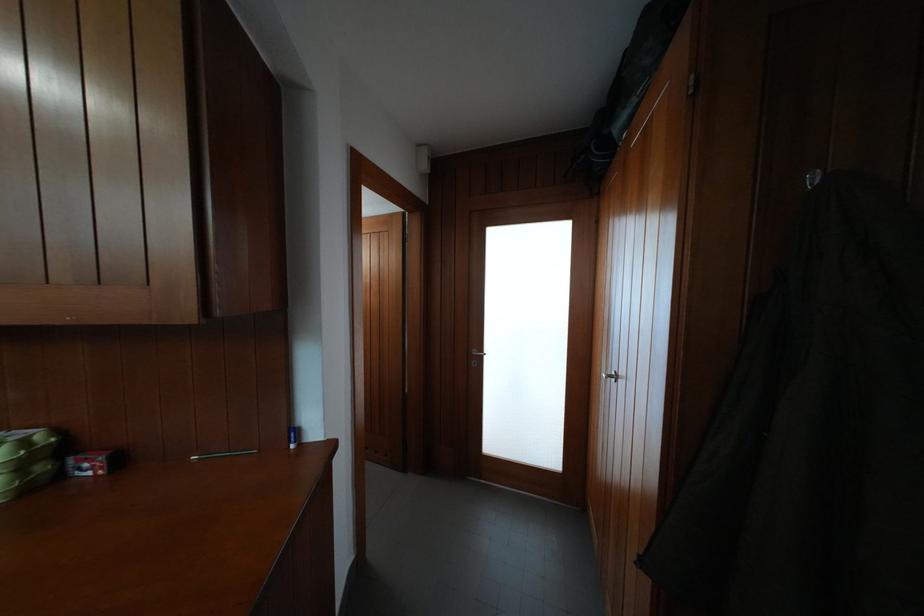
What do you see at coordinates (478, 353) in the screenshot? I see `the silver door handle` at bounding box center [478, 353].